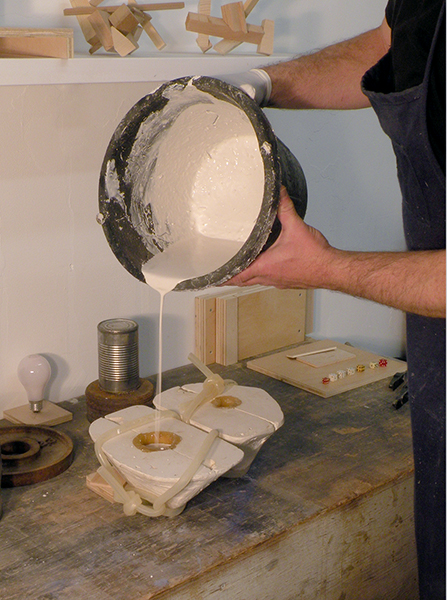
This screenshot has width=447, height=600. Identify the location of top shelf. (123, 64).